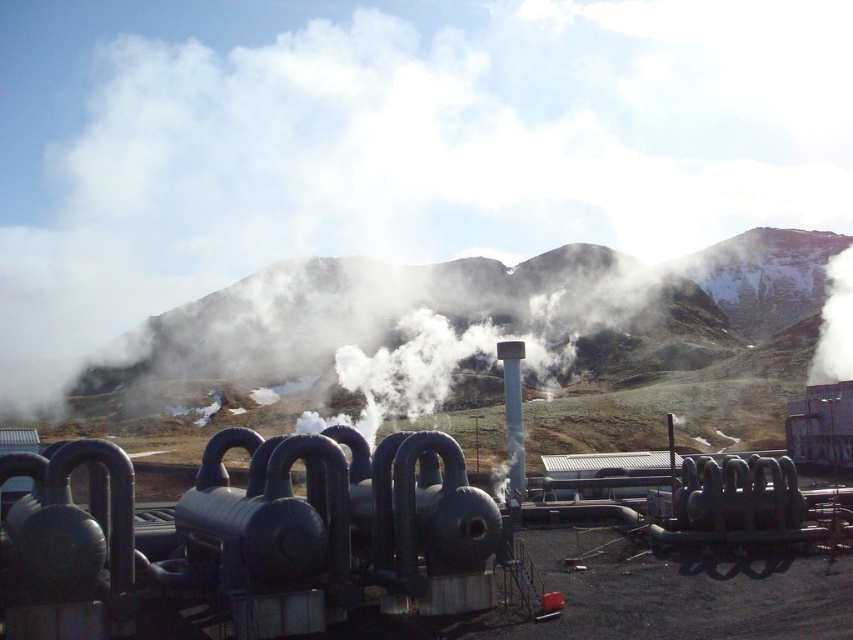
You are a drone operator tasked with capturing aerial footage of the industrial site. Your drone has a maximum flight range of 150 meters. If you are currently positioned at the white smoke at center, can you fly your drone to the green grassy mountain at center without exceeding its range?

The distance between the white smoke at center and the green grassy mountain at center is 158.40 meters, which exceeds the drone flight range of 150 meters. Therefore, the drone cannot reach the green grassy mountain at center without exceeding its maximum range.

You are a technician working at the geothermal plant. You need to locate the white smoke at center. Where exactly is it located in the image?

The white smoke at center is located at point coordinates of 0.223 on the x axis and 0.456 on the y axis.

You are a safety inspector assessing the geothermal plant. You notice the white smoke at center and the green grassy mountain at center. Which object is positioned higher in the scene?

The white smoke at center is located above the green grassy mountain at center, so it is positioned higher in the scene.